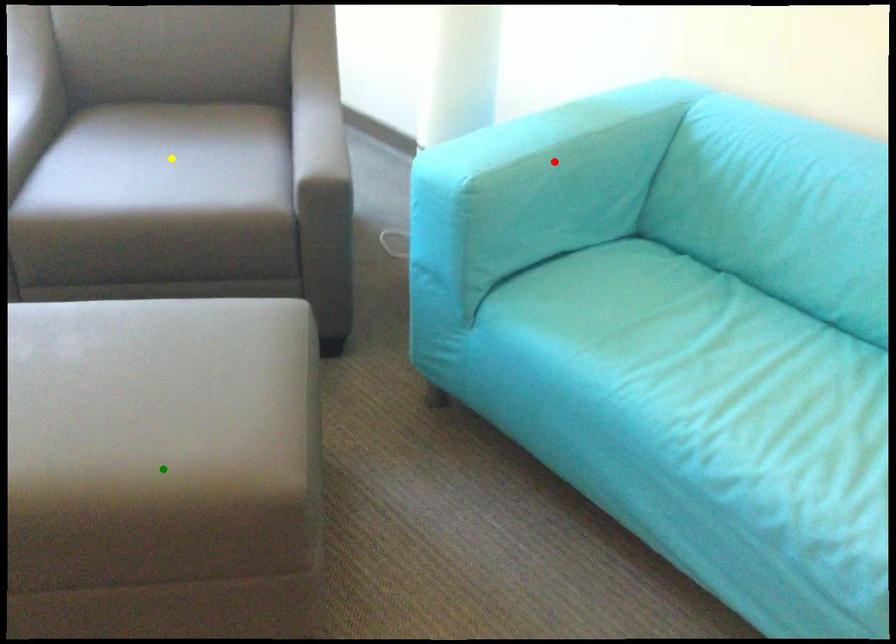
Order these from nearest to farthest:
- red point
- yellow point
- green point

green point < red point < yellow point